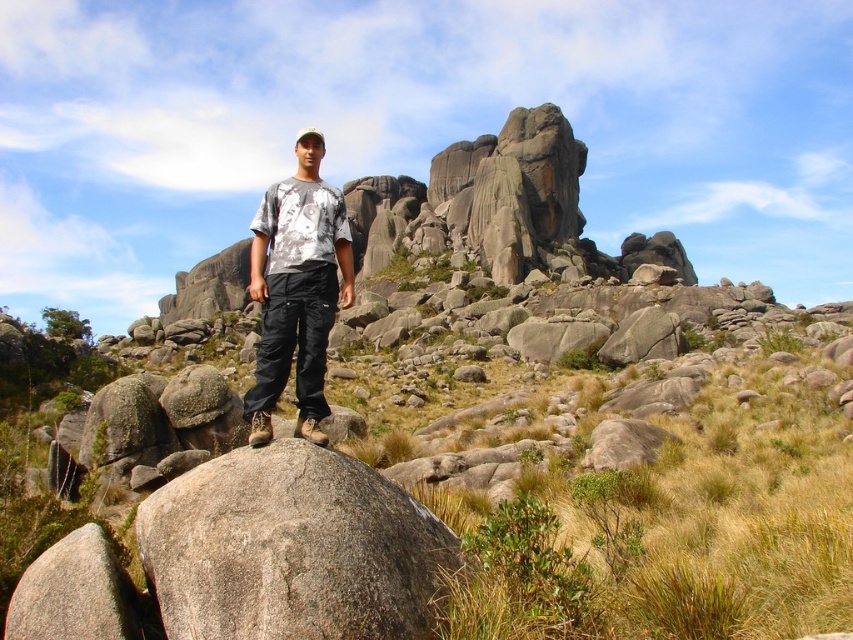
Is gray rough boulder at center closer to camera compared to matte gray t-shirt at center?

That is True.

Which of these two, gray rough boulder at center or matte gray t-shirt at center, stands shorter?

gray rough boulder at center

The width and height of the screenshot is (853, 640). Describe the element at coordinates (291, 548) in the screenshot. I see `gray rough boulder at center` at that location.

Identify the location of gray rough boulder at center. (291, 548).